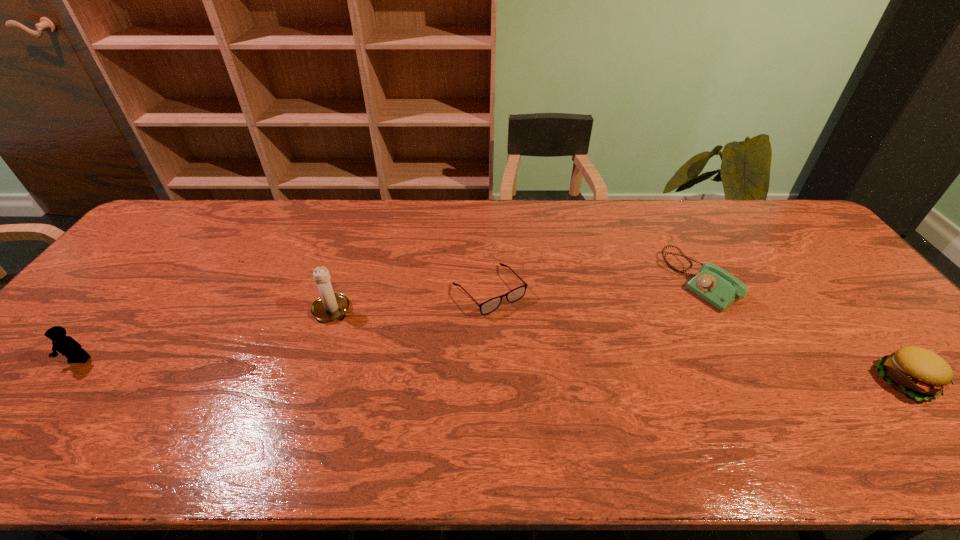
You are a GUI agent. You are given a task and a screenshot of the screen. Output one action in this format:
    pyautogui.click(x=<x>, y=<y>)
    Task: Click on the free space located on the back of the rightmost object
    The height and width of the screenshot is (540, 960).
    Given the screenshot: What is the action you would take?
    pyautogui.click(x=853, y=319)

Identify the location of free region located 0.310m on the front-facing side of the shortest object. This screenshot has height=540, width=960. (587, 399).

The image size is (960, 540). What are the coordinates of `free region located on the front-facing side of the shortest object` in the screenshot? It's located at (546, 354).

Identify the location of vacant space situated 0.230m on the front-facing side of the shortest object. Image resolution: width=960 pixels, height=540 pixels. (564, 374).

Find the location of a particular element. vacant space situated on the handle side of the second object from left to right is located at coordinates (371, 333).

The width and height of the screenshot is (960, 540). In order to click on vacant space located 0.330m on the handle side of the second object from left to right in this screenshot , I will do `click(443, 377)`.

This screenshot has width=960, height=540. In order to click on vacant point located on the handle side of the second object from left to right in this screenshot , I will do `click(385, 341)`.

At what (x,y) coordinates should I click in order to perform the action: click on vacant point located 0.180m on the dial of the second object from right to left. Please return your answer as a coordinate pair (x, y). Looking at the image, I should click on (638, 326).

You are a GUI agent. You are given a task and a screenshot of the screen. Output one action in this format:
    pyautogui.click(x=<x>, y=<y>)
    Task: Click on the free space located 0.390m on the dial of the second object from right to left
    
    Given the screenshot: What is the action you would take?
    pyautogui.click(x=580, y=362)

This screenshot has height=540, width=960. I want to click on free space located 0.170m on the dial of the second object from right to left, so click(641, 325).